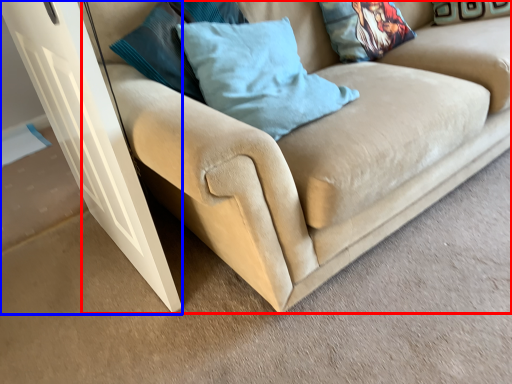
Question: Which object is closer to the camera taking this photo, studio couch (highlighted by a red box) or glass door (highlighted by a blue box)?

Choices:
 (A) studio couch
 (B) glass door

Answer: (A)